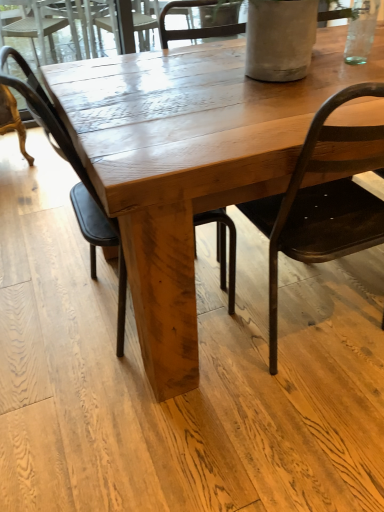
Identify the location of matte black chair at center, the first chair from the left. (77, 183).

I want to click on matte black chair at center, the first chair from the left, so click(x=77, y=183).

Can we say wooden table at center lies outside matte black chair at center, the first chair from the left?

Yes.

Where is `coffee table that is under the matte black chair at center, the first chair from the left (from a real-world perspective)`? coffee table that is under the matte black chair at center, the first chair from the left (from a real-world perspective) is located at coordinates (187, 163).

From the image's perspective, is wooden table at center over matte black chair at center, which is counted as the 2th chair, starting from the right?

Yes, from the image's perspective, wooden table at center is over matte black chair at center, which is counted as the 2th chair, starting from the right.

Considering the relative sizes of wooden table at center and matte black chair at center, the first chair from the left, in the image provided, is wooden table at center shorter than matte black chair at center, the first chair from the left,?

Yes, wooden table at center is shorter than matte black chair at center, the first chair from the left.

Is wooden table at center positioned beyond the bounds of matte black chair at right, which appears as the first chair when viewed from the right?

Yes.

Consider the image. Is wooden table at center looking in the opposite direction of matte black chair at right, which appears as the first chair when viewed from the right?

That's not correct — wooden table at center is not looking away from matte black chair at right, which appears as the first chair when viewed from the right.

Which is behind, wooden table at center or matte black chair at right, acting as the 2th chair starting from the left?

wooden table at center is further away from the camera.

Is matte black chair at center, which is counted as the 2th chair, starting from the right, facing towards wooden table at center?

Yes, matte black chair at center, which is counted as the 2th chair, starting from the right, is aimed at wooden table at center.

Based on the photo, what's the angular difference between matte black chair at center, the first chair from the left, and wooden table at center's facing directions?

The angle between the facing direction of matte black chair at center, the first chair from the left, and the facing direction of wooden table at center is 2.34 degrees.

Which object is positioned more to the left, matte black chair at center, which is counted as the 2th chair, starting from the right, or wooden table at center?

From the viewer's perspective, matte black chair at center, which is counted as the 2th chair, starting from the right, appears more on the left side.

Is matte black chair at center, which is counted as the 2th chair, starting from the right, outside of wooden table at center?

No.

From the image's perspective, does matte black chair at right, acting as the 2th chair starting from the left, appear higher than matte black chair at center, the first chair from the left?

No.

Is the surface of matte black chair at right, acting as the 2th chair starting from the left, in direct contact with matte black chair at center, the first chair from the left?

matte black chair at right, acting as the 2th chair starting from the left, is not next to matte black chair at center, the first chair from the left, and they're not touching.

From a real-world perspective, which object stands above the other?

In real-world perspective, matte black chair at right, which appears as the first chair when viewed from the right, is above.

From the image's perspective, is matte black chair at center, the first chair from the left, located above or below matte black chair at right, which appears as the first chair when viewed from the right?

Based on their image positions, matte black chair at center, the first chair from the left, is located above matte black chair at right, which appears as the first chair when viewed from the right.

Does matte black chair at center, the first chair from the left, have a smaller size compared to matte black chair at right, which appears as the first chair when viewed from the right?

Yes, matte black chair at center, the first chair from the left, is smaller than matte black chair at right, which appears as the first chair when viewed from the right.

Can you tell me how much matte black chair at right, which appears as the first chair when viewed from the right, and wooden table at center differ in facing direction?

There is a 91.1-degree angle between the facing directions of matte black chair at right, which appears as the first chair when viewed from the right, and wooden table at center.

Which object is thinner, matte black chair at right, which appears as the first chair when viewed from the right, or wooden table at center?

matte black chair at right, which appears as the first chair when viewed from the right.

Identify the location of coffee table that is under the matte black chair at right, which appears as the first chair when viewed from the right (from a real-world perspective). Image resolution: width=384 pixels, height=512 pixels. (187, 163).

Consider the image. Measure the distance between matte black chair at right, which appears as the first chair when viewed from the right, and wooden table at center.

31.32 centimeters.

Find the location of a particular element. Image resolution: width=384 pixels, height=512 pixels. chair behind the wooden table at center is located at coordinates (77, 183).

In the image, there is a matte black chair at right, which appears as the first chair when viewed from the right. At what (x,y) coordinates should I click in order to perform the action: click on coffee table below it (from a real-world perspective). Please return your answer as a coordinate pair (x, y). The width and height of the screenshot is (384, 512). Looking at the image, I should click on (187, 163).

Looking at the image, which one is located closer to wooden table at center, matte black chair at center, which is counted as the 2th chair, starting from the right, or matte black chair at right, which appears as the first chair when viewed from the right?

matte black chair at right, which appears as the first chair when viewed from the right, lies closer to wooden table at center than the other object.

Which object lies nearer to the anchor point matte black chair at right, which appears as the first chair when viewed from the right, matte black chair at center, the first chair from the left, or wooden table at center?

wooden table at center is positioned closer to the anchor matte black chair at right, which appears as the first chair when viewed from the right.

From the image, which object appears to be farther from matte black chair at right, acting as the 2th chair starting from the left, wooden table at center or matte black chair at center, the first chair from the left?

Among the two, matte black chair at center, the first chair from the left, is located further to matte black chair at right, acting as the 2th chair starting from the left.

Which object lies further to the anchor point matte black chair at center, the first chair from the left, wooden table at center or matte black chair at right, which appears as the first chair when viewed from the right?

matte black chair at right, which appears as the first chair when viewed from the right, is positioned further to the anchor matte black chair at center, the first chair from the left.

Which object lies nearer to the anchor point wooden table at center, matte black chair at right, which appears as the first chair when viewed from the right, or matte black chair at center, the first chair from the left?

matte black chair at right, which appears as the first chair when viewed from the right, lies closer to wooden table at center than the other object.

Looking at the image, which one is located further to matte black chair at center, the first chair from the left, matte black chair at right, which appears as the first chair when viewed from the right, or wooden table at center?

Based on the image, matte black chair at right, which appears as the first chair when viewed from the right, appears to be further to matte black chair at center, the first chair from the left.

The width and height of the screenshot is (384, 512). I want to click on chair situated between matte black chair at center, which is counted as the 2th chair, starting from the right, and wooden table at center from left to right, so click(x=321, y=204).